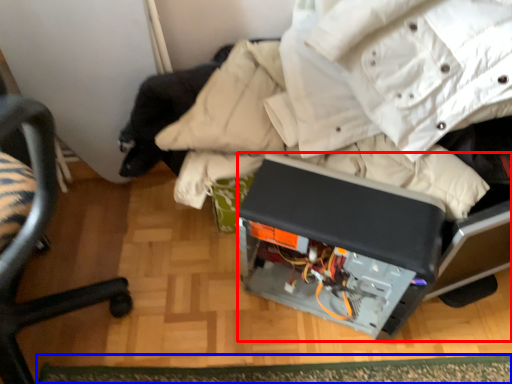
Question: Among these objects, which one is nearest to the camera, wide (highlighted by a red box) or mat (highlighted by a blue box)?

Choices:
 (A) wide
 (B) mat

Answer: (A)